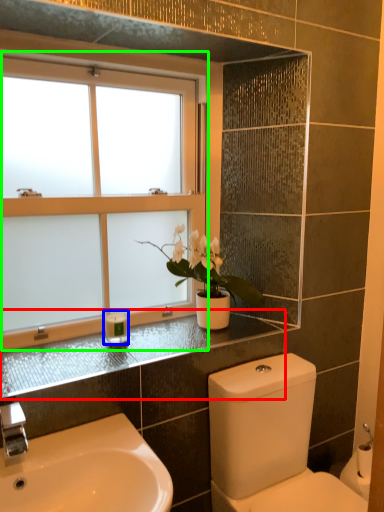
Question: Considering the real-world distances, which object is closest to counter top (highlighted by a red box)? toiletry (highlighted by a blue box) or window (highlighted by a green box).

Choices:
 (A) toiletry
 (B) window

Answer: (A)